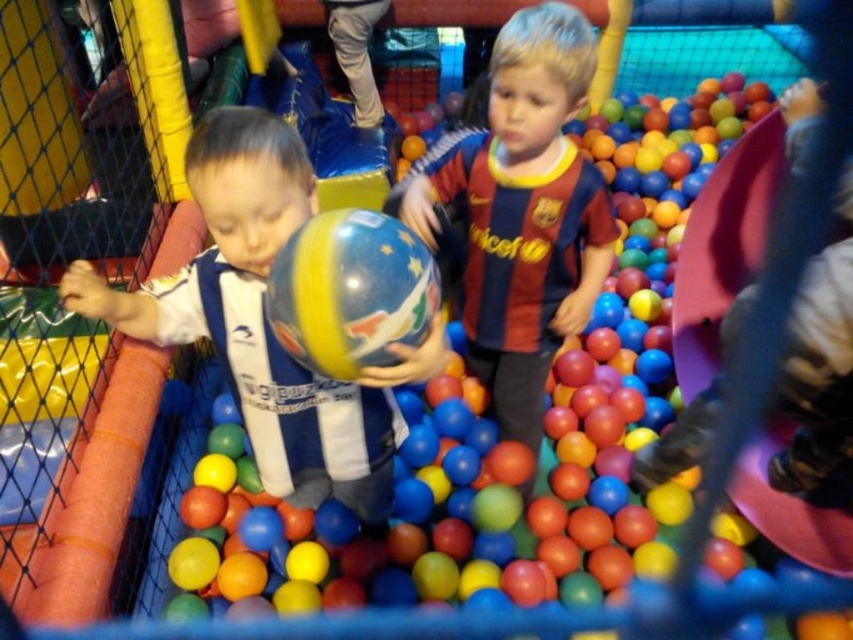
Question: Does white striped jersey at left lie in front of glossy plastic beach ball at center?

Choices:
 (A) yes
 (B) no

Answer: (B)

Question: Which of these objects is positioned closest to the maroon jersey at center?

Choices:
 (A) glossy rubber ball at center
 (B) glossy plastic beach ball at center

Answer: (B)

Question: Is white striped jersey at left bigger than glossy plastic beach ball at center?

Choices:
 (A) no
 (B) yes

Answer: (B)

Question: Which point is closer to the camera?

Choices:
 (A) (434, 637)
 (B) (264, 333)
 (C) (543, 296)

Answer: (B)

Question: Which point is farther from the camera taking this photo?

Choices:
 (A) (335, 307)
 (B) (534, 52)
 (C) (207, 268)
 (D) (608, 624)

Answer: (D)

Question: Can you confirm if white striped jersey at left is positioned below maroon jersey at center?

Choices:
 (A) yes
 (B) no

Answer: (A)